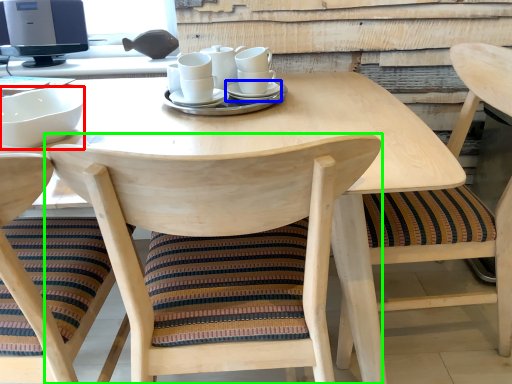
Question: Which object is the closest to the bowl (highlighted by a red box)? Choose among these: saucer (highlighted by a blue box) or chair (highlighted by a green box).

Choices:
 (A) saucer
 (B) chair

Answer: (B)